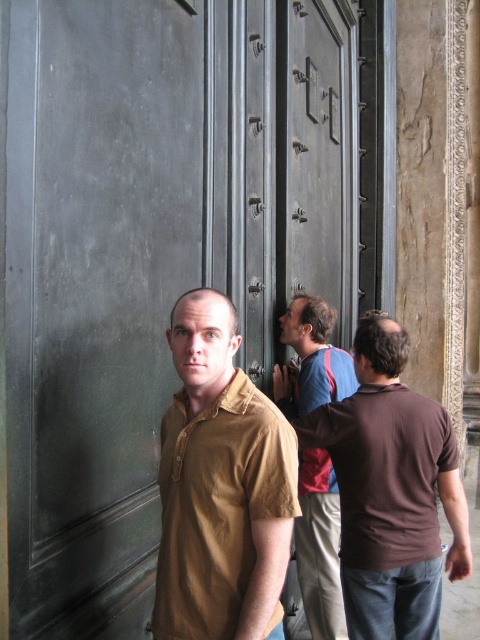
Does point (263, 554) lie behind point (348, 360)?

No, (263, 554) is closer to viewer.

At what (x,y) coordinates should I click in order to perform the action: click on brown cotton shirt at center. Please return your answer as a coordinate pair (x, y). Looking at the image, I should click on (x=220, y=486).

Locate an element on the screen. This screenshot has height=640, width=480. brown cotton shirt at center is located at coordinates (220, 486).

Can you confirm if brown cotton shirt at center is positioned below brown cotton shirt at right?

Actually, brown cotton shirt at center is above brown cotton shirt at right.

Who is lower down, brown cotton shirt at center or brown cotton shirt at right?

brown cotton shirt at right is lower down.

The image size is (480, 640). Describe the element at coordinates (220, 486) in the screenshot. I see `brown cotton shirt at center` at that location.

At what (x,y) coordinates should I click in order to perform the action: click on brown cotton shirt at center. Please return your answer as a coordinate pair (x, y). The image size is (480, 640). Looking at the image, I should click on click(220, 486).

Does point (354, 452) come farther from viewer compared to point (292, 396)?

No, it is in front of (292, 396).

Can you confirm if brown cotton shirt at right is wider than blue striped shirt at center?

Indeed, brown cotton shirt at right has a greater width compared to blue striped shirt at center.

Between point (362, 408) and point (337, 579), which one is positioned in front?

Point (362, 408) is in front.

Locate an element on the screen. Image resolution: width=480 pixels, height=640 pixels. brown cotton shirt at right is located at coordinates (391, 490).